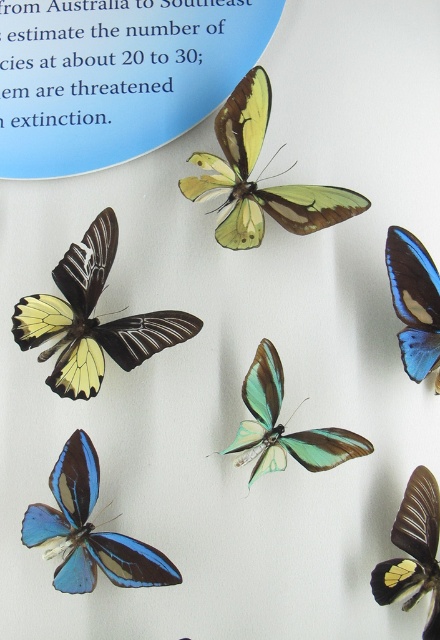
Question: Which of the following is the closest to the observer?

Choices:
 (A) (413, 554)
 (B) (84, 301)
 (C) (261, 419)

Answer: (A)

Question: Can you confirm if blue translucent butterfly at lower left is wider than matte black butterfly at upper right?

Choices:
 (A) yes
 (B) no

Answer: (A)

Question: Which is farther from the translucent yellow-green butterfly at upper center?

Choices:
 (A) translucent green butterfly at center
 (B) blue glossy butterfly at upper right
 (C) matte black butterfly at upper right

Answer: (C)

Question: Which point is closer to the camera?

Choices:
 (A) matte black butterfly at upper right
 (B) blue glossy butterfly at upper right

Answer: (A)

Question: Does translucent yellow-green butterfly at upper center have a smaller size compared to blue translucent butterfly at lower left?

Choices:
 (A) yes
 (B) no

Answer: (B)

Question: Is matte yellow butterfly at left further to the viewer compared to translucent yellow-green butterfly at upper center?

Choices:
 (A) no
 (B) yes

Answer: (A)